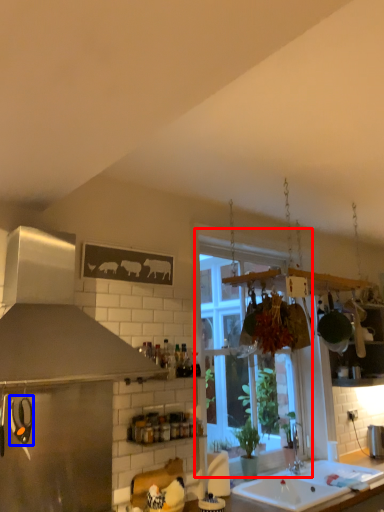
Question: Which point is closer to the camera, window (highlighted by a red box) or appliance (highlighted by a blue box)?

Choices:
 (A) window
 (B) appliance

Answer: (B)